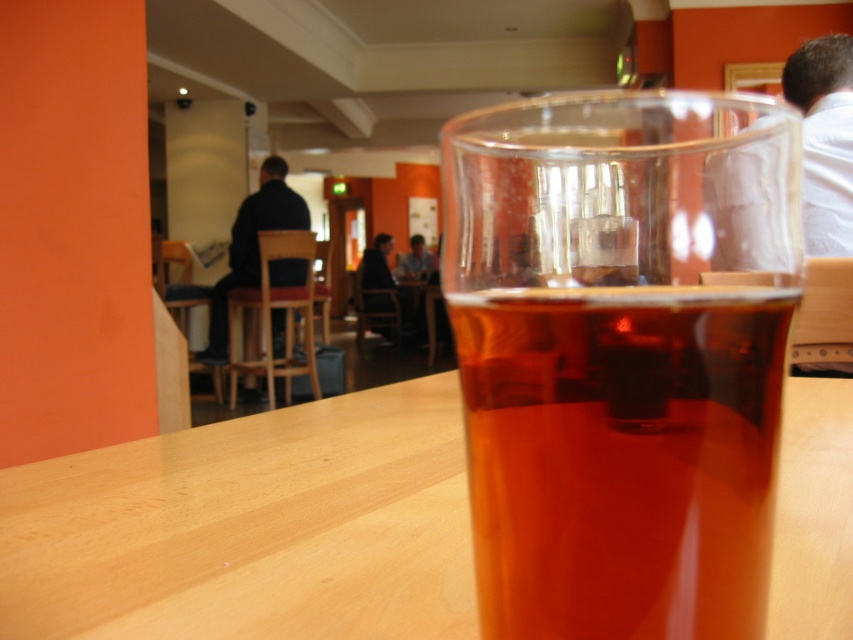
You are standing in the cozy indoor setting and want to walk towards the two points marked in the image. Which point, point (752, 609) or point (331, 589), will you reach first?

Point (752, 609) is closer to the viewer than point (331, 589), so you will reach point (752, 609) first.

You are a barista trying to clean the translucent glass at center and the light wood table at center. Which object requires you to reach higher to clean?

The translucent glass at center requires reaching higher because it is much taller than the light wood table at center.